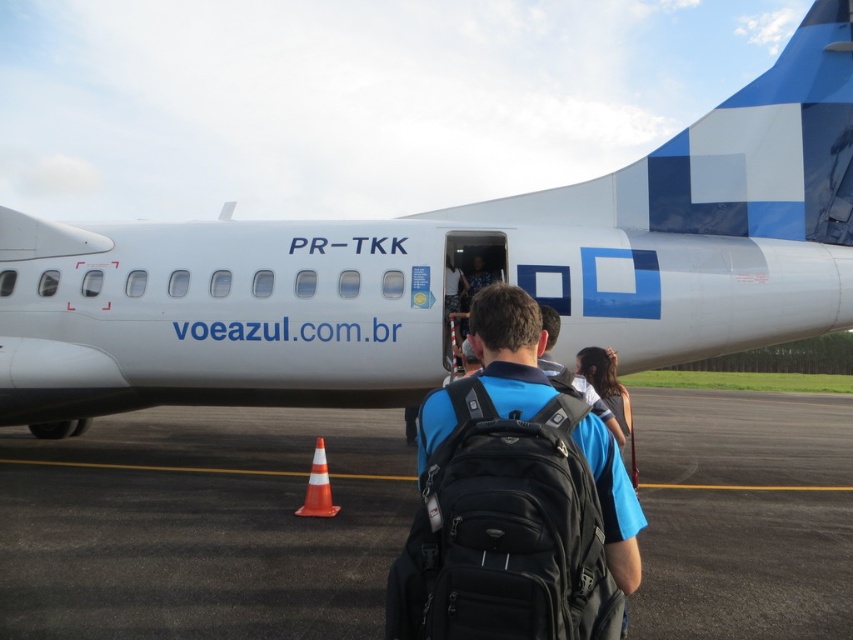
Based on the photo, between black asphalt at center and black matte backpack at center, which one has less height?

black asphalt at center is shorter.

Between point (730, 524) and point (524, 403), which one is positioned in front?

Point (524, 403) is more forward.

At what (x,y) coordinates should I click in order to perform the action: click on black asphalt at center. Please return your answer as a coordinate pair (x, y). The image size is (853, 640). Looking at the image, I should click on (200, 525).

Who is positioned more to the left, white matte airplane at center or black asphalt at center?

white matte airplane at center

Consider the image. Does white matte airplane at center appear on the right side of black asphalt at center?

No, white matte airplane at center is not to the right of black asphalt at center.

Is point (128, 273) behind point (386, 476)?

Yes, it is behind point (386, 476).

Locate an element on the screen. The height and width of the screenshot is (640, 853). white matte airplane at center is located at coordinates (451, 269).

Which of these two, white matte airplane at center or black matte backpack at center, stands shorter?

white matte airplane at center

You are a GUI agent. You are given a task and a screenshot of the screen. Output one action in this format:
    pyautogui.click(x=<x>, y=<y>)
    Task: Click on the white matte airplane at center
    This screenshot has width=853, height=640.
    Given the screenshot: What is the action you would take?
    pyautogui.click(x=451, y=269)

Locate an element on the screen. white matte airplane at center is located at coordinates (451, 269).